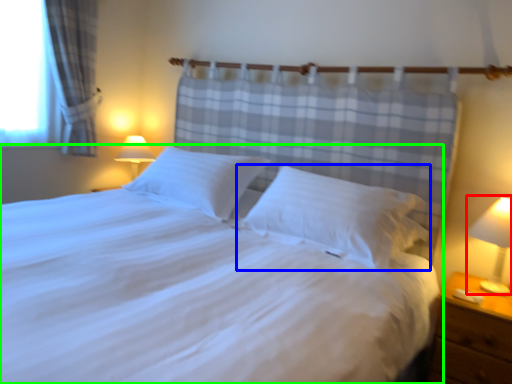
Question: Estimate the real-world distances between objects in this image. Which object is closer to bedside lamp (highlighted by a red box), pillow (highlighted by a blue box) or bed (highlighted by a green box)?

Choices:
 (A) pillow
 (B) bed

Answer: (A)